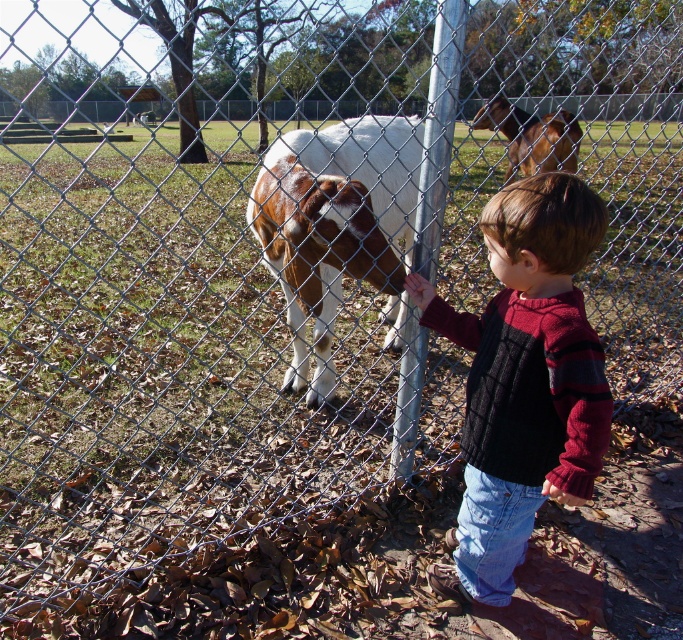
Measure the distance between point (402, 225) and camera.

3.16 meters

Who is positioned more to the left, brown and white fur at center or brown glossy horse at upper center?

brown and white fur at center is more to the left.

Measure the distance between point (395, 330) and camera.

3.86 meters

Image resolution: width=683 pixels, height=640 pixels. I want to click on brown and white fur at center, so click(337, 227).

Between knitted sweater at center and brown glossy horse at upper center, which one appears on the right side from the viewer's perspective?

brown glossy horse at upper center

Who is lower down, knitted sweater at center or brown glossy horse at upper center?

knitted sweater at center

Image resolution: width=683 pixels, height=640 pixels. I want to click on knitted sweater at center, so click(x=525, y=378).

Is knitted sweater at center positioned in front of brown and white fur at center?

Yes, it is.

Is knitted sweater at center thinner than brown and white fur at center?

Indeed, knitted sweater at center has a lesser width compared to brown and white fur at center.

Does point (531, 314) come behind point (290, 282)?

No, it is in front of (290, 282).

Locate an element on the screen. The height and width of the screenshot is (640, 683). knitted sweater at center is located at coordinates (525, 378).